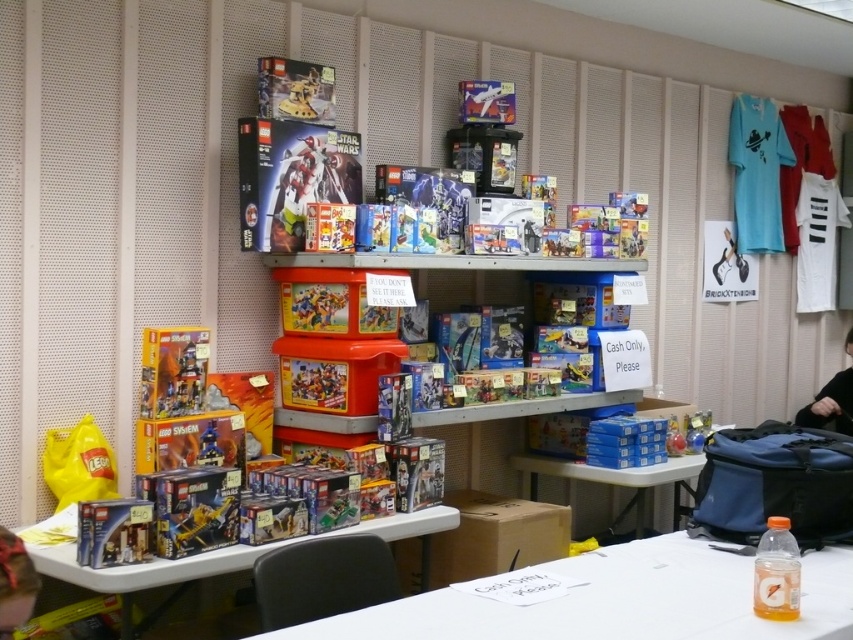
Is blue cardboard boxes at center closer to the viewer compared to matte black hair at lower left?

No, it is not.

Is blue cardboard boxes at center to the left of matte black hair at lower left from the viewer's perspective?

No, blue cardboard boxes at center is not to the left of matte black hair at lower left.

You are a GUI agent. You are given a task and a screenshot of the screen. Output one action in this format:
    pyautogui.click(x=<x>, y=<y>)
    Task: Click on the blue cardboard boxes at center
    This screenshot has width=853, height=640.
    Given the screenshot: What is the action you would take?
    pyautogui.click(x=612, y=480)

Between white paperboard at lower center and matte plastic storage bin at center, which one appears on the right side from the viewer's perspective?

white paperboard at lower center is more to the right.

Which is below, white paperboard at lower center or matte plastic storage bin at center?

white paperboard at lower center is below.

Identify the location of white paperboard at lower center. The width and height of the screenshot is (853, 640). (616, 600).

I want to click on white paperboard at lower center, so click(x=616, y=600).

Measure the distance between point (83, 586) and camera.

The distance of point (83, 586) from camera is 7.69 feet.

Between point (207, 576) and point (624, 483), which one is positioned behind?

The point (624, 483) is behind.

In order to click on matte plastic lego boxes at center in this screenshot , I will do `click(143, 570)`.